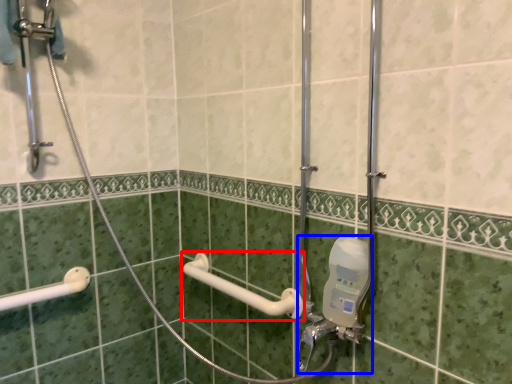
Question: Among these objects, which one is farthest to the camera, towel bar (highlighted by a red box) or plumbing fixture (highlighted by a blue box)?

Choices:
 (A) towel bar
 (B) plumbing fixture

Answer: (A)